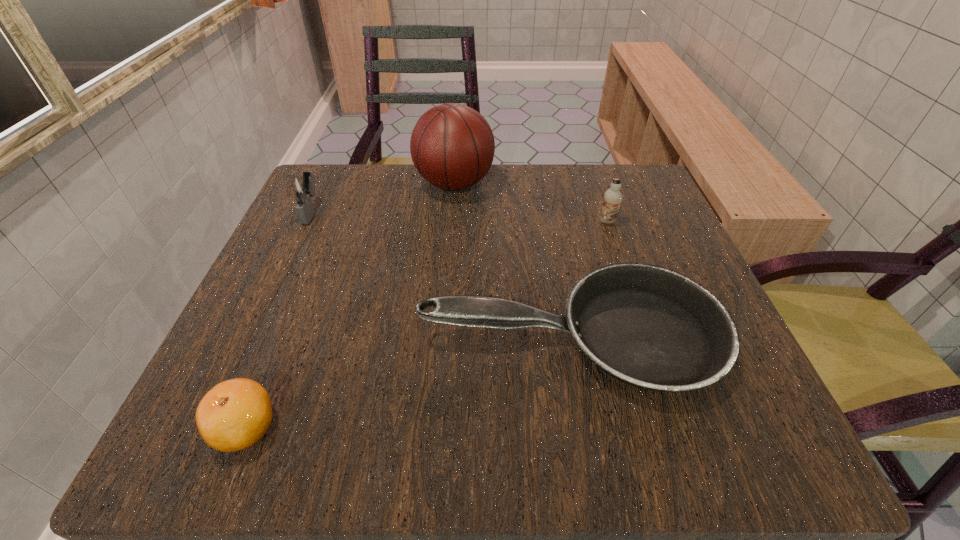
At what (x,y) coordinates should I click in order to perform the action: click on free space that satisfies the following two spatial constraints: 1. on the back side of the chocolate milk; 2. on the right side of the frying pan. Please return your answer as a coordinate pair (x, y). This screenshot has width=960, height=540. Looking at the image, I should click on (549, 221).